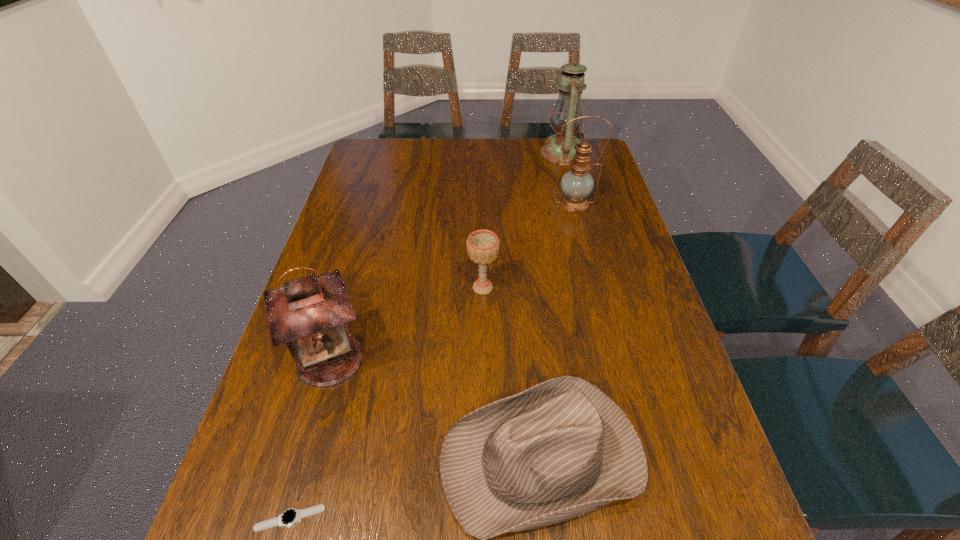
This screenshot has height=540, width=960. In order to click on the farthest object in this screenshot , I will do `click(571, 85)`.

At what (x,y) coordinates should I click in order to perform the action: click on the tallest oil lamp. Please return your answer as a coordinate pair (x, y). This screenshot has height=540, width=960. Looking at the image, I should click on (571, 85).

In order to click on the fifth nearest object in this screenshot , I will do `click(576, 184)`.

At what (x,y) coordinates should I click in order to perform the action: click on the nearest oil lamp. Please return your answer as a coordinate pair (x, y). Looking at the image, I should click on (310, 314).

Image resolution: width=960 pixels, height=540 pixels. I want to click on the third shortest object, so tap(482, 245).

At what (x,y) coordinates should I click in order to perform the action: click on chalice. Please return your answer as a coordinate pair (x, y). The height and width of the screenshot is (540, 960). Looking at the image, I should click on (482, 245).

You are a GUI agent. You are given a task and a screenshot of the screen. Output one action in this format:
    pyautogui.click(x=<x>, y=<y>)
    Task: Click on the shortest object
    
    Given the screenshot: What is the action you would take?
    pyautogui.click(x=289, y=517)

In order to click on blank space located on the left of the tallest oil lamp in this screenshot , I will do `click(478, 153)`.

Where is `free region located on the front of the second farthest oil lamp`? The width and height of the screenshot is (960, 540). free region located on the front of the second farthest oil lamp is located at coordinates (596, 290).

You are a GUI agent. You are given a task and a screenshot of the screen. Output one action in this format:
    pyautogui.click(x=<x>, y=<y>)
    Task: Click on the blank space located on the back of the leftmost oil lamp
    This screenshot has height=540, width=960.
    Given the screenshot: What is the action you would take?
    [x=362, y=247]